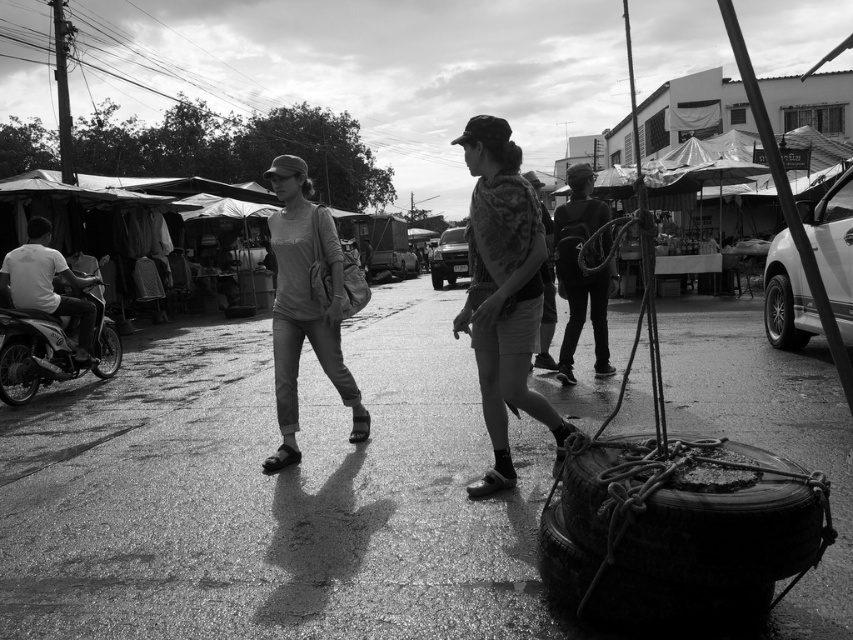
Is matte gray pants at center thinner than rubber tire at lower left?

Incorrect, matte gray pants at center's width is not less than rubber tire at lower left's.

Who is more distant from viewer, (x=349, y=433) or (x=22, y=344)?

The point (x=22, y=344) is behind.

Find the location of `matte gray pants at center`. matte gray pants at center is located at coordinates (306, 304).

Can you confirm if rough rubber tire at lower right is thinner than rubber/textured tire at right?

No, rough rubber tire at lower right is not thinner than rubber/textured tire at right.

Does point (659, 621) come closer to viewer compared to point (786, 289)?

Yes, it is.

Does point (647, 611) come in front of point (785, 291)?

Yes, it is in front of point (785, 291).

Identify the location of rough rubber tire at lower right. tap(636, 589).

Is point (482, 259) farther from camera compared to point (109, 326)?

No, (482, 259) is in front of (109, 326).

Is point (502, 337) positioned after point (109, 355)?

No, (502, 337) is closer to viewer.

Find the location of a particular element. Image resolution: width=853 pixels, height=640 pixels. camo fabric shirt at center is located at coordinates (503, 292).